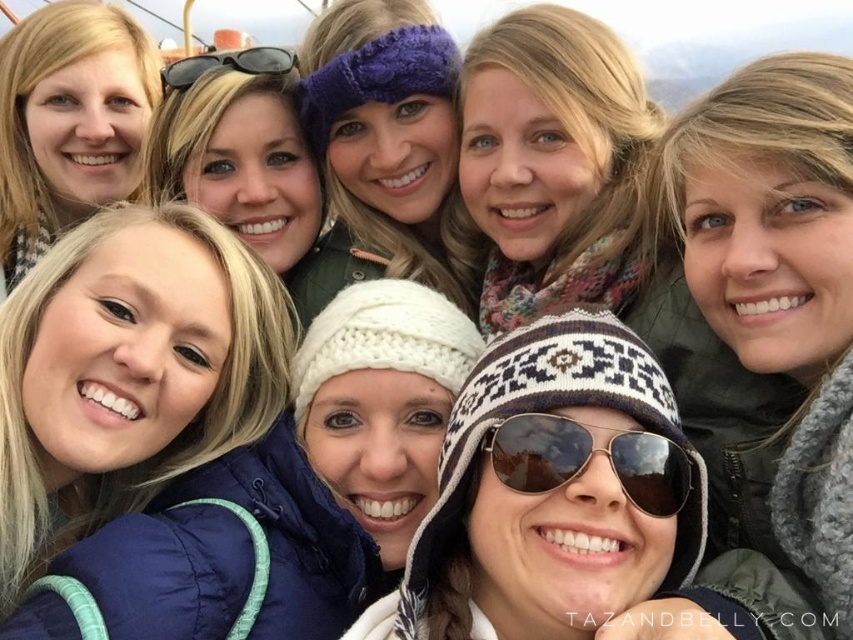
Question: Which object is the farthest from the white knitted hat at center?

Choices:
 (A) purple fuzzy headband at center
 (B) floral scarf at upper center
 (C) black reflective sunglasses at upper left
 (D) matte black hair at upper left

Answer: (D)

Question: Which of the following is the farthest from the observer?

Choices:
 (A) floral scarf at upper center
 (B) gold metallic goggles at center
 (C) matte black hair at upper left
 (D) blue quilted jacket at lower left

Answer: (C)

Question: Is white knitted hat at center bigger than gold metallic goggles at center?

Choices:
 (A) no
 (B) yes

Answer: (B)

Question: Which is nearer to the floral scarf at upper center?

Choices:
 (A) purple fuzzy headband at center
 (B) gold metallic goggles at center
 (C) black reflective sunglasses at upper left

Answer: (A)

Question: Does floral scarf at upper center have a greater width compared to matte black hair at upper left?

Choices:
 (A) no
 (B) yes

Answer: (A)

Question: Is white knitted hat at center positioned before matte black hair at upper left?

Choices:
 (A) yes
 (B) no

Answer: (A)